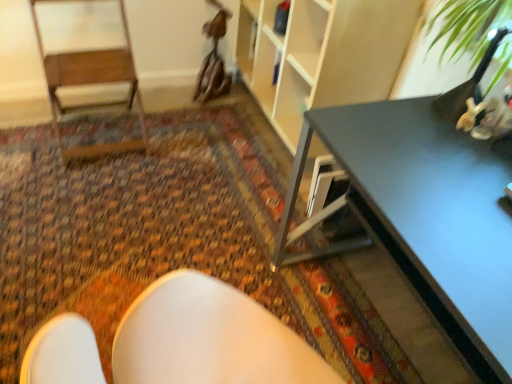
Question: From a real-world perspective, is matte black table at right physically located above or below wooden armchair at left?

Choices:
 (A) below
 (B) above

Answer: (A)

Question: In terms of height, does matte black table at right look taller or shorter compared to wooden armchair at left?

Choices:
 (A) tall
 (B) short

Answer: (B)

Question: Based on their relative distances, which object is farther from the matte black table at right?

Choices:
 (A) wooden armchair at left
 (B) carpeted floor at center

Answer: (A)

Question: Based on their relative distances, which object is farther from the wooden armchair at left?

Choices:
 (A) matte black table at right
 (B) carpeted floor at center

Answer: (A)